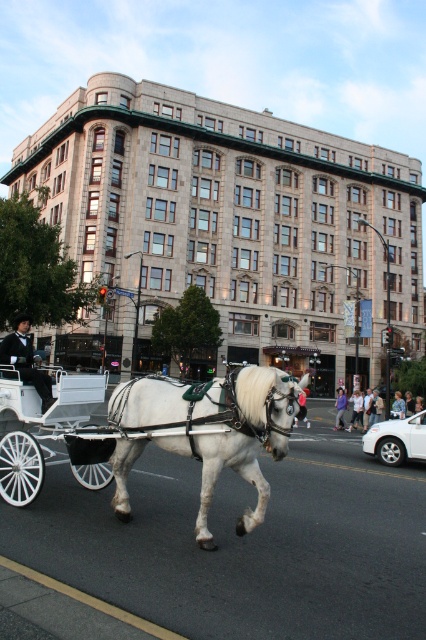
Question: Among these points, which one is nearest to the camera?

Choices:
 (A) (20, 378)
 (B) (5, 412)
 (C) (238, 531)

Answer: (C)

Question: Can you confirm if white glossy horse at center is smaller than white leather coach at center?

Choices:
 (A) no
 (B) yes

Answer: (A)

Question: Can you confirm if white glossy horse at center is bigger than white polished wood cart at center?

Choices:
 (A) yes
 (B) no

Answer: (B)

Question: Can you confirm if white glossy horse at center is thinner than white polished wood cart at center?

Choices:
 (A) yes
 (B) no

Answer: (A)

Question: Which object is closer to the camera taking this photo?

Choices:
 (A) white polished wood cart at center
 (B) white glossy horse at center
 (C) white leather coach at center

Answer: (B)

Question: Which object appears closest to the camera in this image?

Choices:
 (A) white polished wood cart at center
 (B) white leather coach at center
 (C) white glossy horse at center

Answer: (C)